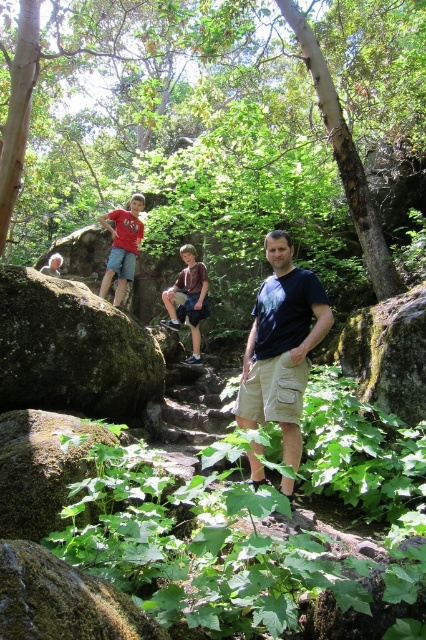
Is brown cotton shirt at center positioned before matte red t-shirt at left?

No.

Is point (187, 246) less distant than point (103, 218)?

No, it is not.

Where is `brown cotton shirt at center`? brown cotton shirt at center is located at coordinates (187, 300).

Is green mossy rock at left smaller than black cotton t-shirt at center?

Actually, green mossy rock at left might be larger than black cotton t-shirt at center.

Which is below, green mossy rock at left or black cotton t-shirt at center?

Positioned lower is green mossy rock at left.

Does point (94, 308) come farther from viewer compared to point (247, 368)?

Yes, point (94, 308) is behind point (247, 368).

What are the coordinates of `green mossy rock at left` in the screenshot? It's located at (71, 349).

Is point (172, 88) positioned before point (259, 294)?

No, it is behind (259, 294).

Which of these two, green leafy forest at center or black cotton t-shirt at center, stands shorter?

black cotton t-shirt at center is shorter.

Identify the location of green leafy forest at center. (207, 100).

I want to click on green leafy forest at center, so click(207, 100).